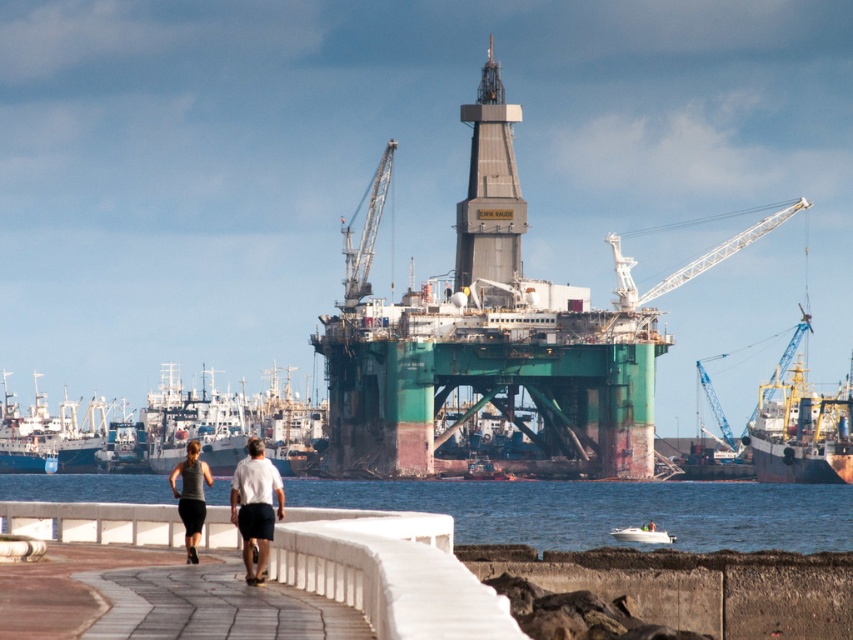
You are a photographer planning to take a wide shot of the harbor scene. You want to ensure that both the clear blue water at lower center and the metallic gray crane at center are visible in your frame. Based on their sizes, which object will occupy more of the photo?

The clear blue water at lower center is bigger than the metallic gray crane at center, so it will occupy more space in the photo.

You are a harbor worker needing to transport a large cargo container that requires a vessel with a minimum width of 20 meters. Based on the scene, which of the two vessels, the blue matte ship at left or the white glossy boat at lower center, is more suitable for your task?

The blue matte ship at left is more suitable because its width surpasses that of the white glossy boat at lower center, meeting the minimum requirement of 20 meters for transporting the large cargo container.